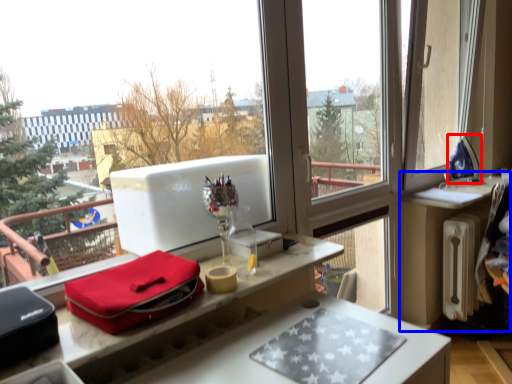
Question: Which point is further to the camera, appliance (highlighted by a red box) or table (highlighted by a blue box)?

Choices:
 (A) appliance
 (B) table

Answer: (A)